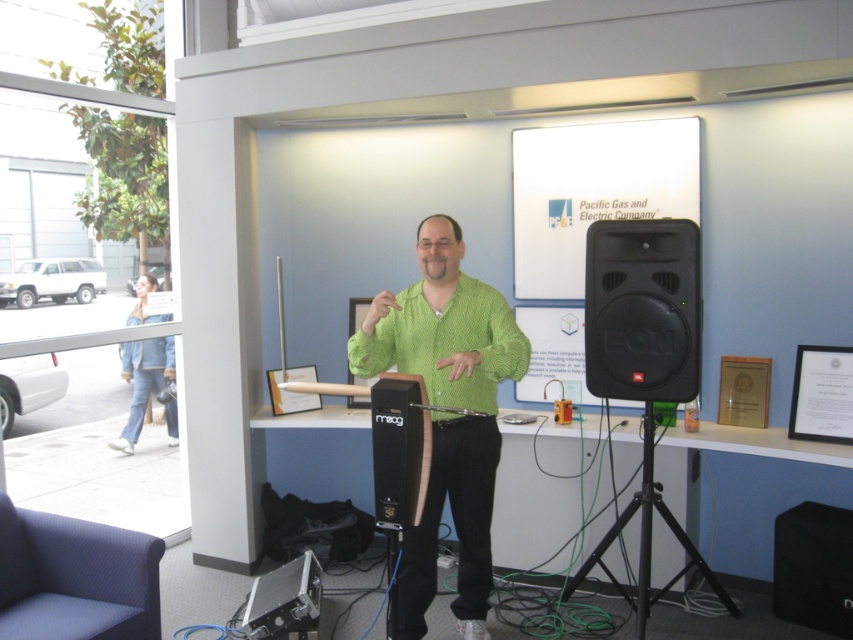
Question: Can you confirm if green textured shirt at center is positioned to the left of black matte speaker at center?

Choices:
 (A) yes
 (B) no

Answer: (B)

Question: Which point is farther to the camera?

Choices:
 (A) black matte tripod at lower right
 (B) black plastic speaker at right
 (C) green textured shirt at center

Answer: (A)

Question: Which object appears farthest from the camera in this image?

Choices:
 (A) green textured shirt at center
 (B) black plastic speaker at right
 (C) black matte tripod at lower right

Answer: (C)

Question: Does green textured shirt at center have a larger size compared to black matte speaker at center?

Choices:
 (A) yes
 (B) no

Answer: (A)

Question: Where is green textured shirt at center located in relation to black matte speaker at center in the image?

Choices:
 (A) left
 (B) right

Answer: (B)

Question: Which object is closer to the camera taking this photo?

Choices:
 (A) green textured shirt at center
 (B) black plastic speaker at right
 (C) black matte tripod at lower right
 (D) black matte speaker at center

Answer: (D)